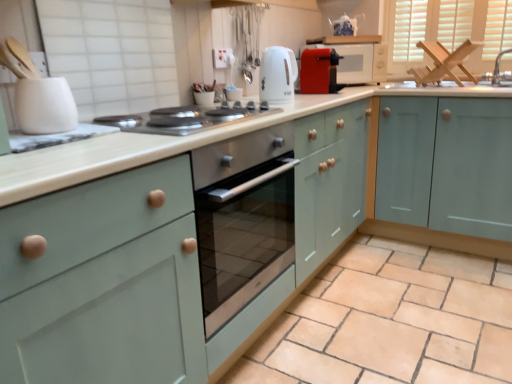
Question: Looking at their shapes, would you say wooden frame at upper right is wider or thinner than stainless steel cooktop at center?

Choices:
 (A) thin
 (B) wide

Answer: (A)

Question: From the image's perspective, is wooden frame at upper right above or below stainless steel cooktop at center?

Choices:
 (A) above
 (B) below

Answer: (A)

Question: Which of these objects is positioned closest to the teal matte cabinet at right?

Choices:
 (A) matte red microwave at upper right
 (B) wooden frame at upper right
 (C) silver metallic faucet at upper right
 (D) blue and white porcelain tea pot at upper center
 (E) white glossy electric kettle at upper center, the second kitchen appliance in the front-to-back sequence

Answer: (A)

Question: Which is farther from the white glossy electric kettle at upper center, acting as the second kitchen appliance starting from the top?

Choices:
 (A) teal matte cabinet at right
 (B) silver metallic faucet at upper right
 (C) stainless steel cooktop at center
 (D) matte red toaster at upper center, the 3th kitchen appliance from the front
 (E) blue and white porcelain tea pot at upper center

Answer: (B)